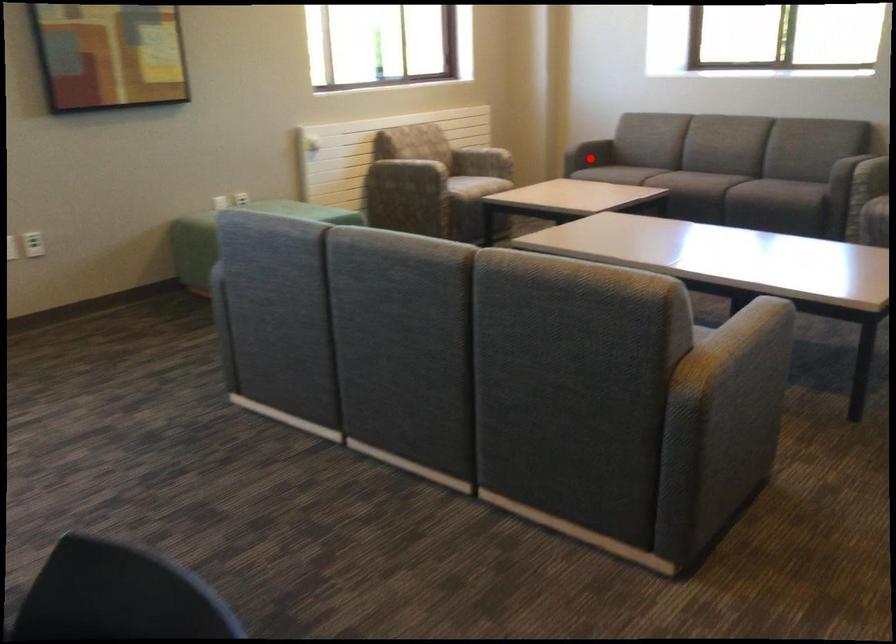
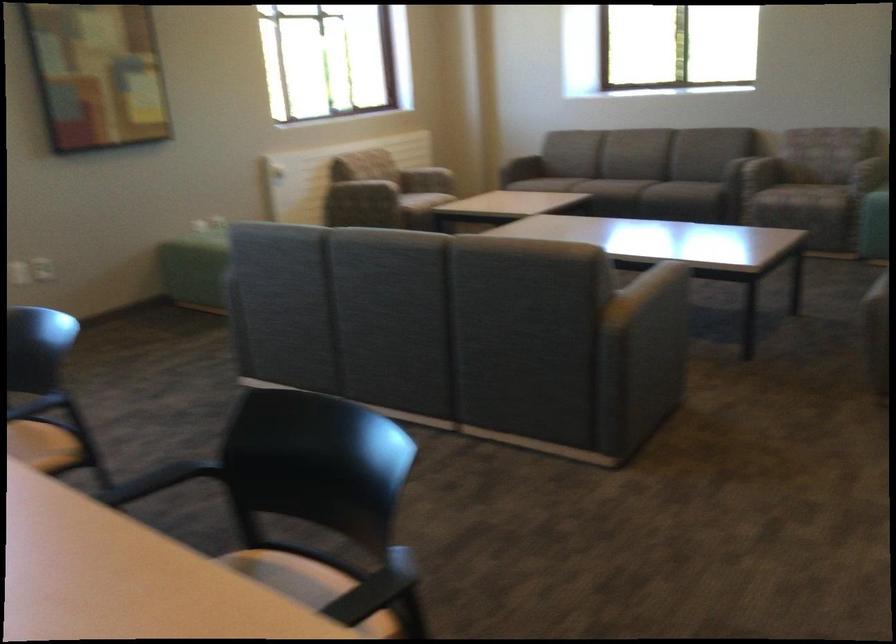
Question: I am providing you with two images of the same scene from different viewpoints. Image1 has a red point marked. In image2, the corresponding 3D location appears at what relative position? Reply with the corresponding letter.

Choices:
 (A) Closer
 (B) Farther

Answer: (B)